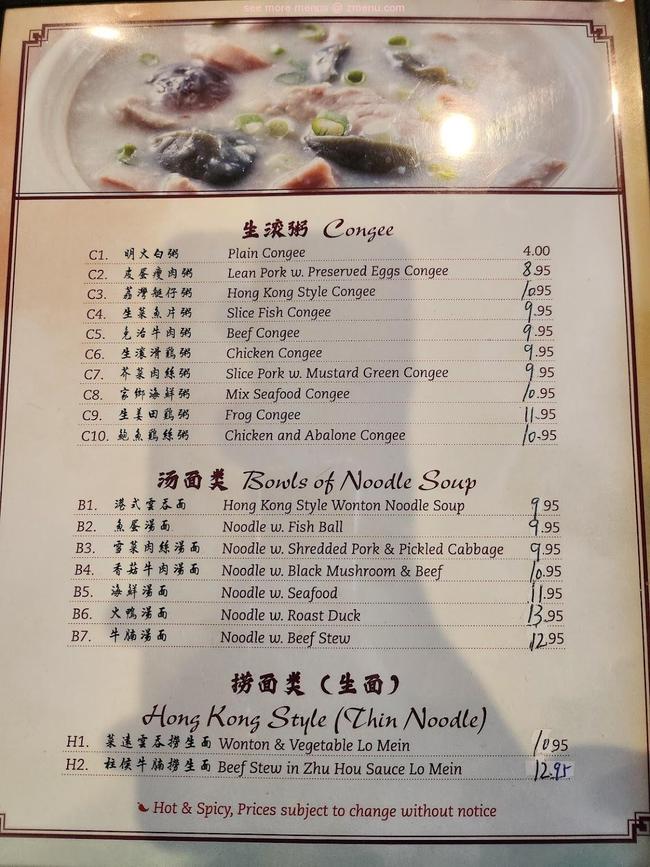
Identify the location of white bowl. This screenshot has height=867, width=650. click(47, 106).